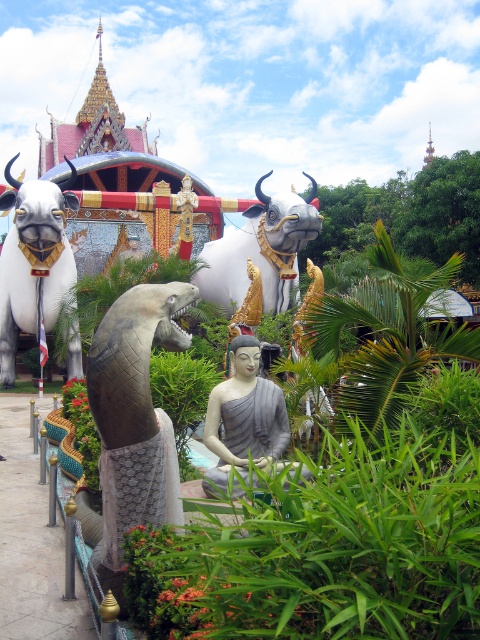
Question: Estimate the real-world distances between objects in this image. Which object is closer to the shiny metallic snake at center?

Choices:
 (A) white glossy statue at center
 (B) gray stone statue at center

Answer: (B)

Question: Does shiny metallic snake at center appear on the right side of white glossy bull at upper left?

Choices:
 (A) no
 (B) yes

Answer: (B)

Question: Which point is closer to the camera?

Choices:
 (A) gray stone statue at center
 (B) white glossy bull at upper left
 (C) white glossy statue at center
 (D) shiny metallic snake at center

Answer: (D)

Question: Which point appears farthest from the camera in this image?

Choices:
 (A) (29, 294)
 (B) (256, 456)

Answer: (A)

Question: Does shiny metallic snake at center come behind white glossy bull at upper left?

Choices:
 (A) yes
 (B) no

Answer: (B)

Question: Observing the image, what is the correct spatial positioning of white glossy bull at upper left in reference to gray stone statue at center?

Choices:
 (A) left
 (B) right

Answer: (A)